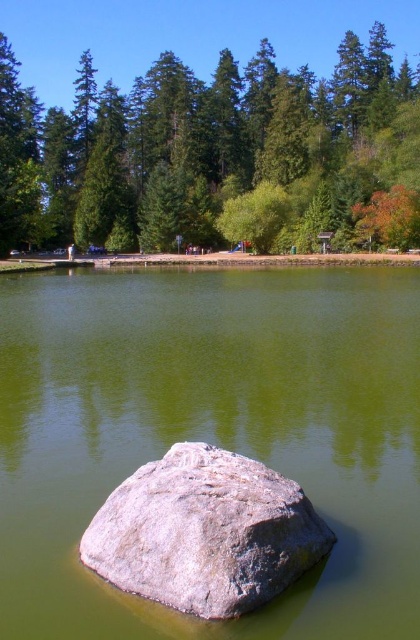
Does smooth gray rock at center have a larger size compared to green matte tree at upper center?

No.

Does smooth gray rock at center appear over green matte tree at upper center?

No.

Between point (378, 477) and point (141, 116), which one is positioned in front?

Point (378, 477)

Locate an element on the screen. The image size is (420, 640). smooth gray rock at center is located at coordinates (210, 433).

Which of these two, green matte tree at upper center or gray rough rock at center, stands taller?

green matte tree at upper center is taller.

Measure the distance from green matte tree at upper center to gray rough rock at center.

The distance of green matte tree at upper center from gray rough rock at center is 82.00 meters.

Is point (12, 164) positioned after point (139, 552)?

Yes, it is behind point (139, 552).

The width and height of the screenshot is (420, 640). I want to click on green matte tree at upper center, so click(204, 147).

Who is shorter, smooth gray rock at center or gray rough rock at center?

Standing shorter between the two is gray rough rock at center.

Locate an element on the screen. The width and height of the screenshot is (420, 640). smooth gray rock at center is located at coordinates (210, 433).

Does point (259, 285) come closer to viewer compared to point (273, 513)?

No, it is not.

Locate an element on the screen. Image resolution: width=420 pixels, height=640 pixels. smooth gray rock at center is located at coordinates (210, 433).